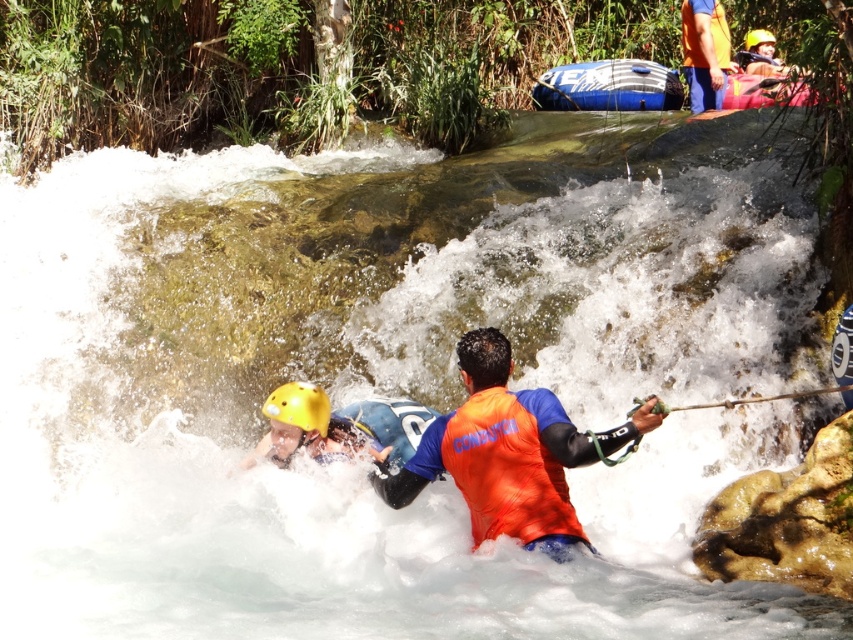
You are a safety inspector assessing the rafting setup. The safety protocol requires that the distance between the orange fabric life jacket at center and the yellow matte helmet at lower left must be less than 1.5 meters to ensure quick communication between the guide and participant. Is the current distance compliant with this protocol?

The orange fabric life jacket at center and the yellow matte helmet at lower left are 1.57 meters apart, which exceeds the 1.5 meter requirement. Therefore, the current distance does not comply with the safety protocol.

In the scene shown: You are a photographer positioned at the edge of the riverbank. You want to take a photo of both the orange fabric life vest at upper center and the yellow matte helmet at lower left. Which object will appear closer to the camera in the photo?

The orange fabric life vest at upper center will appear closer to the camera because the yellow matte helmet at lower left is behind it.

You are standing on the riverbank observing the orange fabric life vest at upper center. A safety protocol requires that you must stay at least 10 meters away from any life vests in use. Are you currently in compliance with this safety rule?

The orange fabric life vest at upper center is 15.28 meters away from the viewer, which exceeds the required 10 meters distance. Therefore, you are in compliance with the safety protocol.